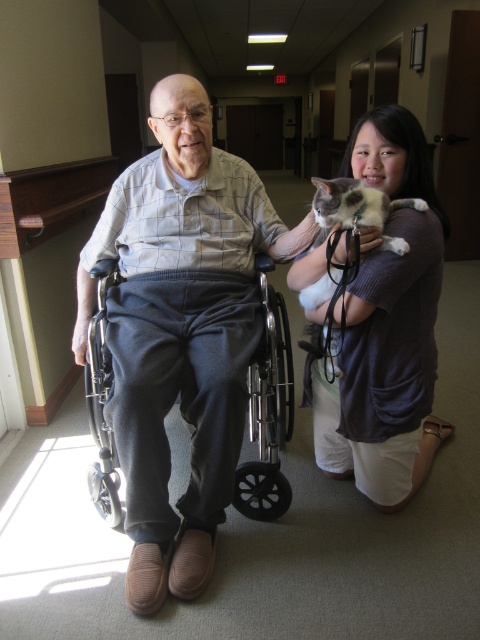
Image resolution: width=480 pixels, height=640 pixels. In order to click on white cotton shirt at lower right in this screenshot , I will do `click(385, 326)`.

Does white cotton shirt at lower right appear on the left side of soft fur cat at right?

Incorrect, white cotton shirt at lower right is not on the left side of soft fur cat at right.

Where is `white cotton shirt at lower right`? The width and height of the screenshot is (480, 640). white cotton shirt at lower right is located at coordinates (385, 326).

Where is `white cotton shirt at lower right`? The image size is (480, 640). white cotton shirt at lower right is located at coordinates (385, 326).

Is gray corduroy pants at center in front of white cotton shirt at lower right?

Result: Yes, gray corduroy pants at center is in front of white cotton shirt at lower right.

Does gray corduroy pants at center appear over white cotton shirt at lower right?

No.

Between point (159, 269) and point (408, 109), which one is positioned behind?

The point (159, 269) is behind.

Locate an element on the screen. The width and height of the screenshot is (480, 640). gray corduroy pants at center is located at coordinates (180, 330).

Can you confirm if metallic gray wheelchair at center is positioned above soft fur cat at right?

No.

From the picture: Who is higher up, metallic gray wheelchair at center or soft fur cat at right?

soft fur cat at right is higher up.

Where is `metallic gray wheelchair at center`? metallic gray wheelchair at center is located at coordinates (267, 410).